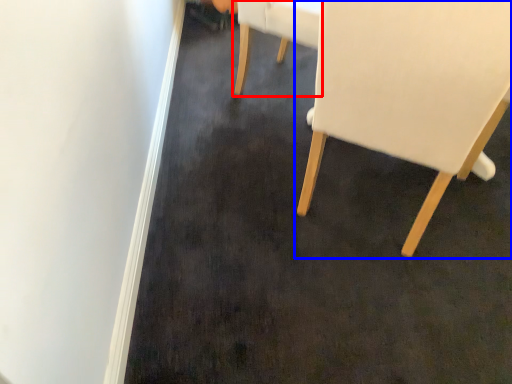
Question: Which of the following is the farthest to the observer, chair (highlighted by a red box) or chair (highlighted by a blue box)?

Choices:
 (A) chair
 (B) chair

Answer: (A)